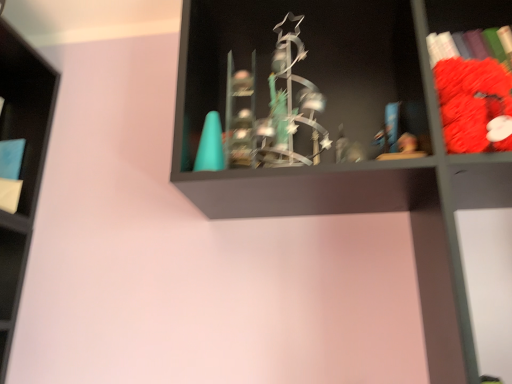
Question: From the image's perspective, relative to velvet red plush toy at right, the 1th book positioned from the front, is blue matte book at left, which is counted as the second book, starting from the front, above or below?

Choices:
 (A) below
 (B) above

Answer: (A)

Question: Considering their positions, is blue matte book at left, which is the 2th book in right-to-left order, located in front of or behind velvet red plush toy at right, the 1th book positioned from the front?

Choices:
 (A) behind
 (B) front

Answer: (A)

Question: Which object is positioned farthest from the metallic statue at center?

Choices:
 (A) blue matte book at left, which is counted as the second book, starting from the front
 (B) velvet red plush toy at right, acting as the second book starting from the back

Answer: (A)

Question: Based on their relative distances, which object is nearer to the velvet red plush toy at right, the 1th book positioned from the front?

Choices:
 (A) blue matte book at left, which is the 2th book in right-to-left order
 (B) metallic statue at center

Answer: (B)